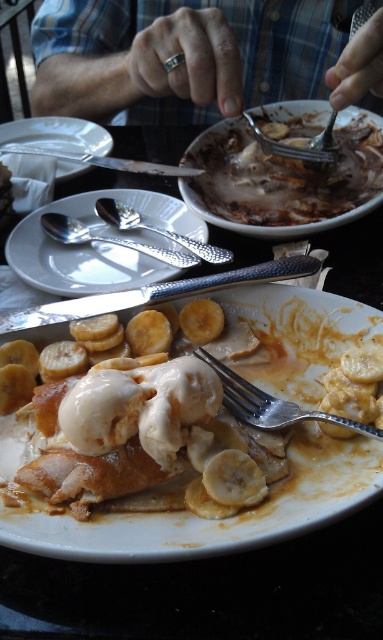
Question: Is satin silver fork at upper center thinner than silver textured spoon at center?

Choices:
 (A) no
 (B) yes

Answer: (A)

Question: Which object appears closest to the camera in this image?

Choices:
 (A) silver metallic spoon at center
 (B) satin silver fork at upper center
 (C) silver textured spoon at center
 (D) silver metallic ring at upper center

Answer: (C)

Question: Does white textured plate at center have a lesser width compared to brushed metal knife at upper center?

Choices:
 (A) yes
 (B) no

Answer: (A)

Question: Which object is the closest to the white glossy plate at center?

Choices:
 (A) white textured plate at center
 (B) silver metallic spoon at center
 (C) silver metallic fork at center

Answer: (C)

Question: Among these points, which one is nearest to the camera?

Choices:
 (A) (366, 163)
 (B) (273, 412)
 (C) (80, 147)

Answer: (B)

Question: Does silver metallic ring at upper center have a larger size compared to white textured plate at center?

Choices:
 (A) no
 (B) yes

Answer: (B)